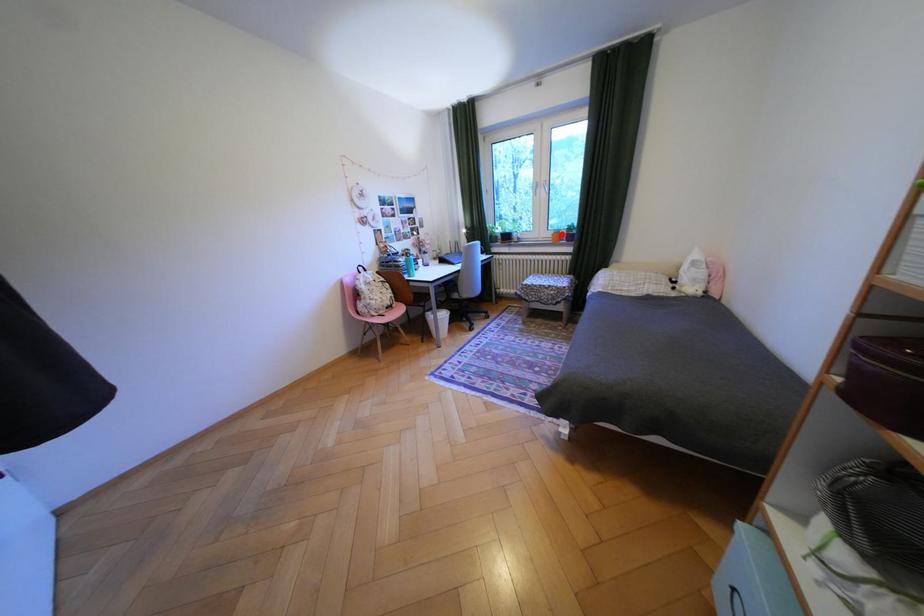
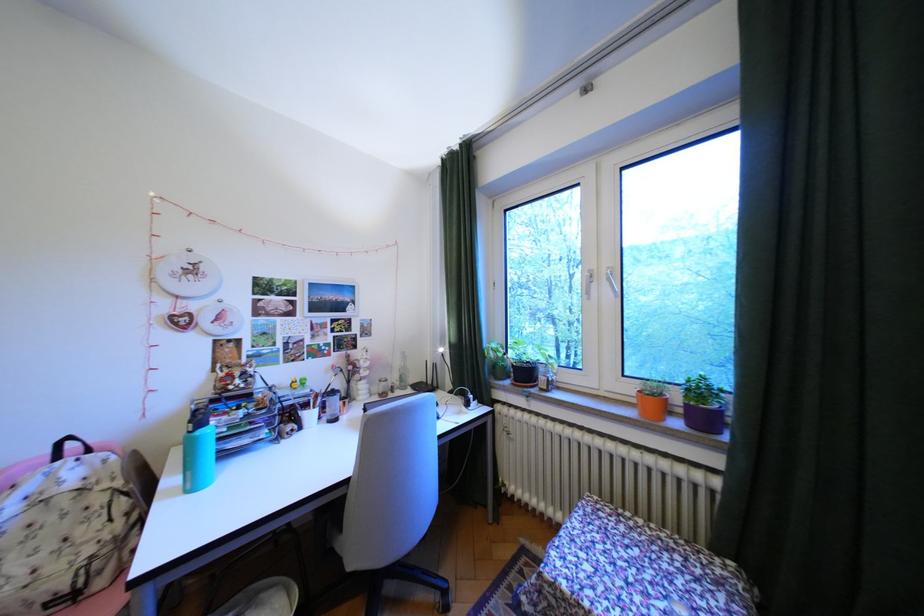
Find the pixel in the second image that matches the highlighted location in the first image.

(641, 390)